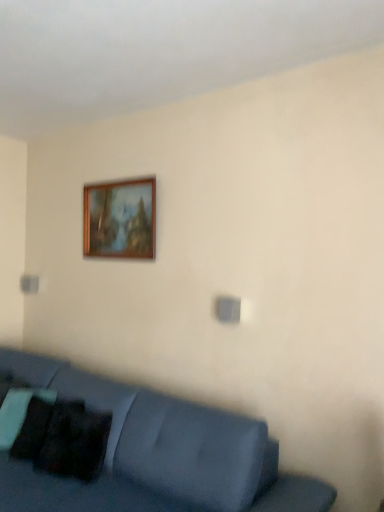
Question: Is black matte pillow at lower left far from matte blue couch at lower left?

Choices:
 (A) no
 (B) yes

Answer: (A)

Question: From the image's perspective, is black matte pillow at lower left over matte blue couch at lower left?

Choices:
 (A) yes
 (B) no

Answer: (A)

Question: Considering the relative sizes of black matte pillow at lower left and matte blue couch at lower left in the image provided, is black matte pillow at lower left bigger than matte blue couch at lower left?

Choices:
 (A) no
 (B) yes

Answer: (A)

Question: From a real-world perspective, does black matte pillow at lower left sit lower than matte blue couch at lower left?

Choices:
 (A) yes
 (B) no

Answer: (B)

Question: Is matte blue couch at lower left surrounded by black matte pillow at lower left?

Choices:
 (A) no
 (B) yes

Answer: (A)

Question: Are black matte pillow at lower left and matte blue couch at lower left making contact?

Choices:
 (A) no
 (B) yes

Answer: (A)

Question: From a real-world perspective, does black matte pillow at lower left stand above wooden picture frame at upper center?

Choices:
 (A) yes
 (B) no

Answer: (B)

Question: Is black matte pillow at lower left touching wooden picture frame at upper center?

Choices:
 (A) yes
 (B) no

Answer: (B)

Question: Is black matte pillow at lower left positioned with its back to wooden picture frame at upper center?

Choices:
 (A) no
 (B) yes

Answer: (A)

Question: Does black matte pillow at lower left appear on the right side of wooden picture frame at upper center?

Choices:
 (A) yes
 (B) no

Answer: (B)

Question: From the image's perspective, does black matte pillow at lower left appear higher than wooden picture frame at upper center?

Choices:
 (A) yes
 (B) no

Answer: (B)

Question: Is black matte pillow at lower left far from wooden picture frame at upper center?

Choices:
 (A) yes
 (B) no

Answer: (A)

Question: Does matte blue couch at lower left lie behind wooden picture frame at upper center?

Choices:
 (A) yes
 (B) no

Answer: (B)